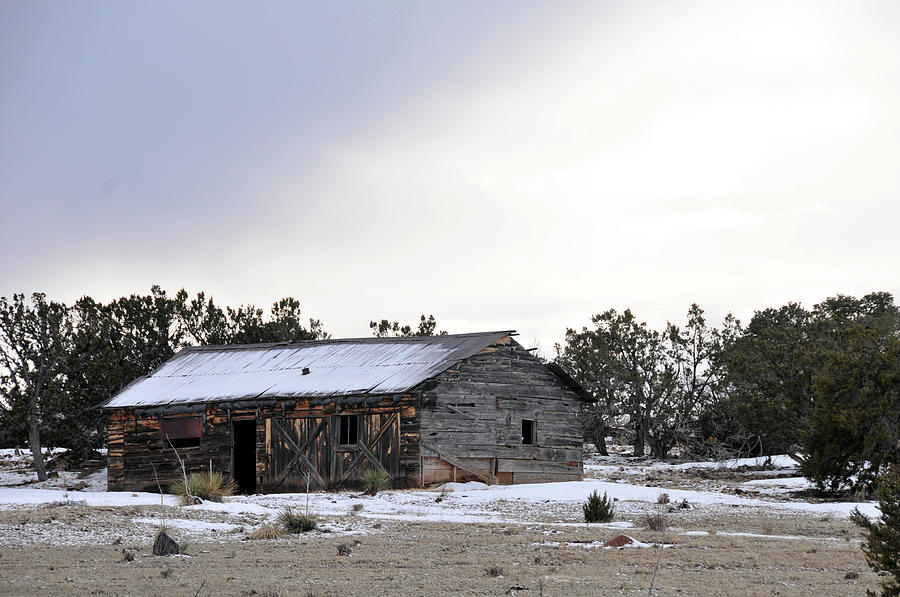
Where is `windows`? windows is located at coordinates (531, 430), (348, 432).